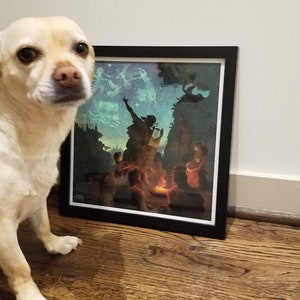
Identify the location of wall. (266, 95).